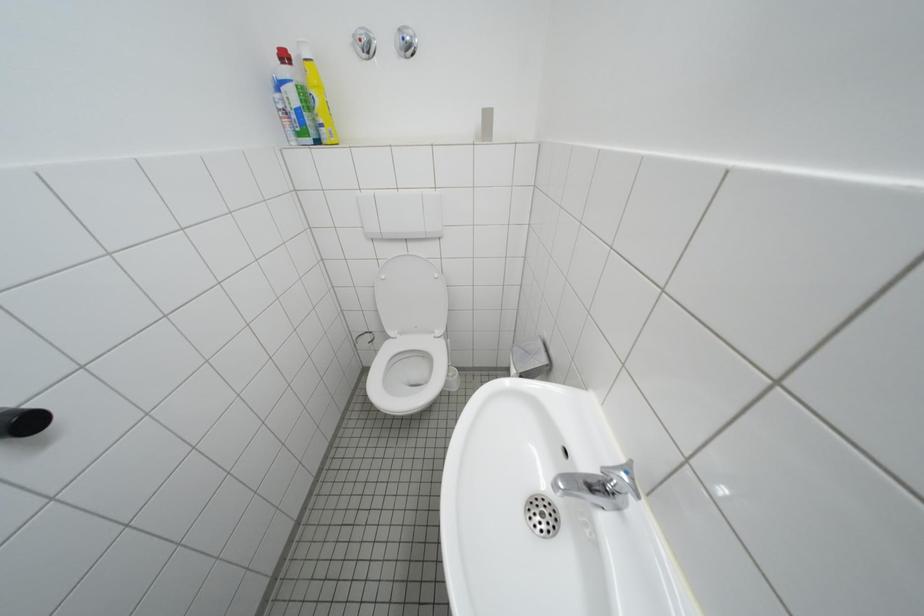
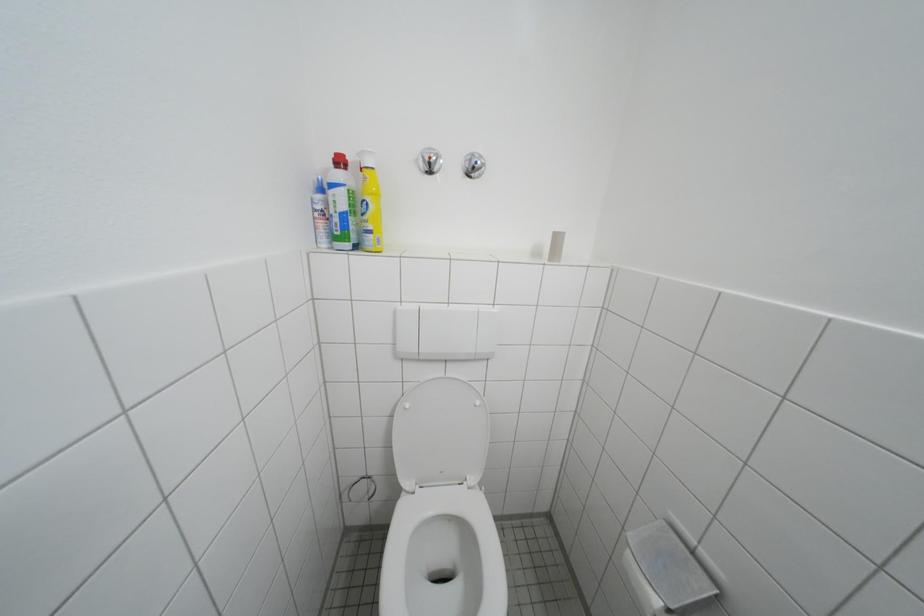
The images are taken continuously from a first-person perspective. In which direction are you moving?

The cameraman moved toward left, forward.